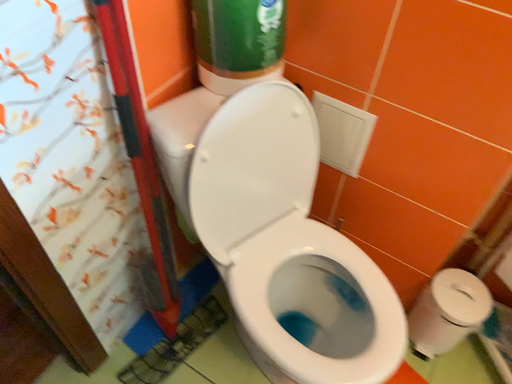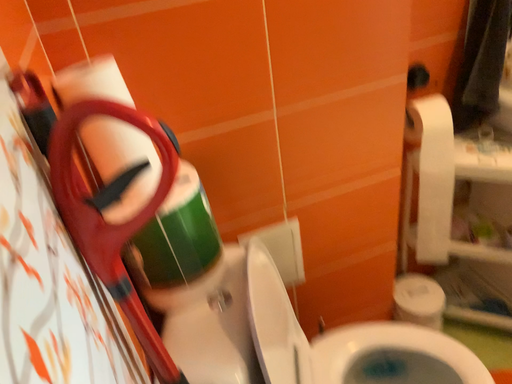
Question: Which way did the camera rotate in the video?

Choices:
 (A) rotated upward
 (B) rotated downward

Answer: (A)